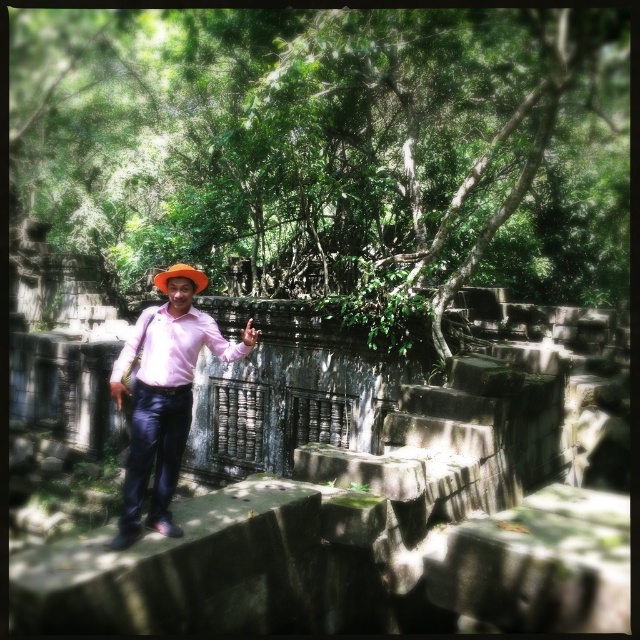
Is point (177, 470) more distant than point (179, 266)?

No, it is not.

Can you confirm if pink matte shirt at center is taller than orange felt hat at center?

Correct, pink matte shirt at center is much taller as orange felt hat at center.

Who is more distant from viewer, (172, 445) or (188, 276)?

The point (188, 276) is behind.

The image size is (640, 640). I want to click on pink matte shirt at center, so (163, 401).